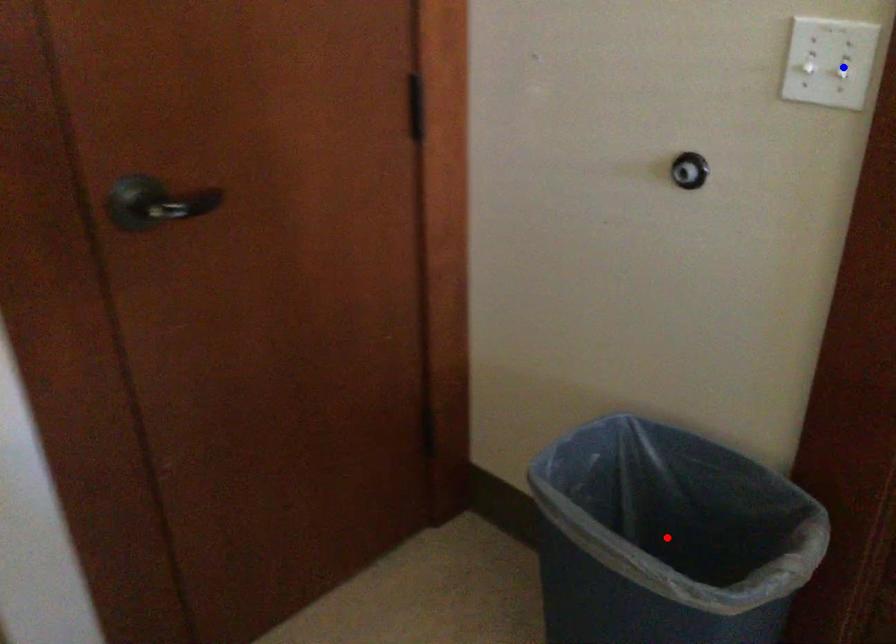
Question: In the image, two points are highlighted. Which point is nearer to the camera? Reply with the corresponding letter.

Choices:
 (A) blue point
 (B) red point

Answer: (A)